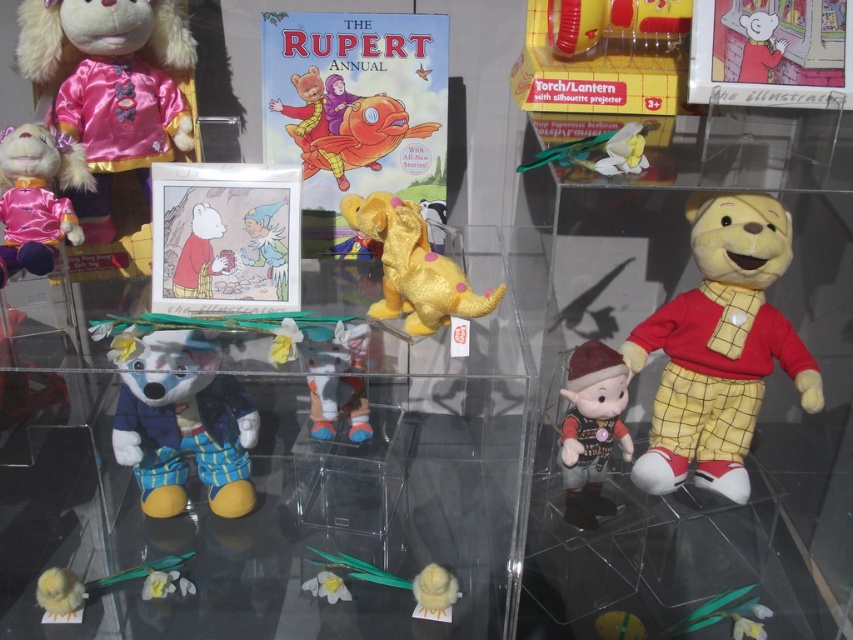
Question: Which object is positioned farthest from the matte red plush bear at upper left?

Choices:
 (A) yellow plush dinosaur at center
 (B) clear acrylic glass table at center
 (C) velvet plush toy at center

Answer: (B)

Question: Is silky pink doll at upper left below silky pink plush at left?

Choices:
 (A) no
 (B) yes

Answer: (A)

Question: Estimate the real-world distances between objects in this image. Which object is farther from the white plush mouse at lower left?

Choices:
 (A) yellow plush winnie the pooh at right
 (B) velvet plush toy at center

Answer: (A)

Question: Does velvet brown plush at center lie behind velvet plush toy at center?

Choices:
 (A) yes
 (B) no

Answer: (A)

Question: Does velvet plush toy at center appear on the left side of yellow plush chick at lower center?

Choices:
 (A) yes
 (B) no

Answer: (A)

Question: Considering the real-world distances, which object is farthest from the velvet brown plush at center?

Choices:
 (A) yellow plush winnie the pooh at right
 (B) silky pink doll at upper left

Answer: (B)